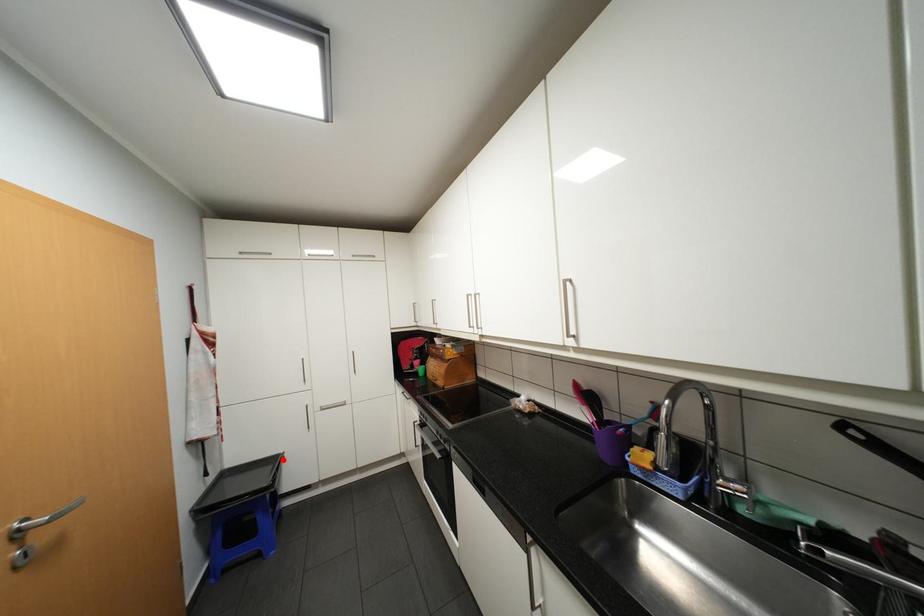
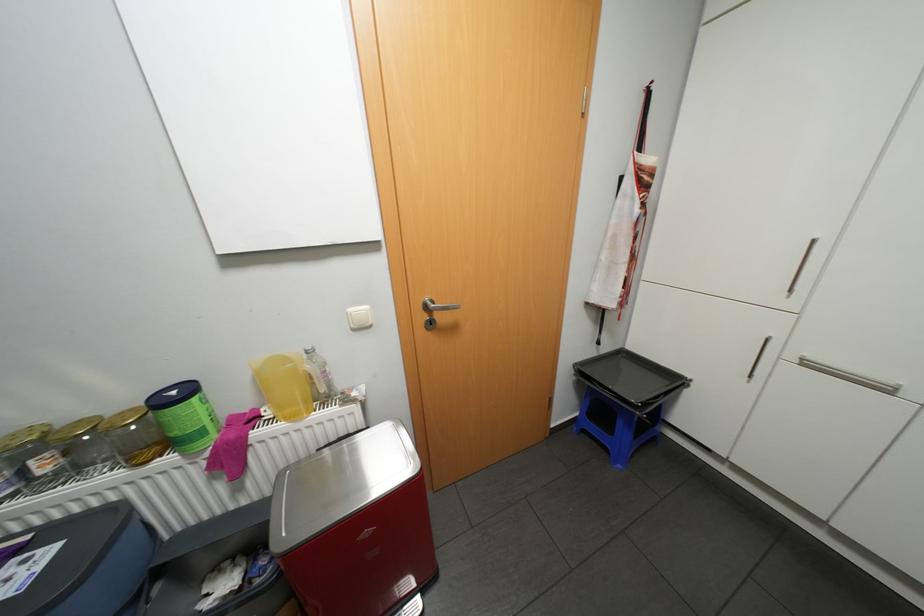
Locate, in the second image, the point that corresponds to the highlighted location in the first image.

(684, 379)